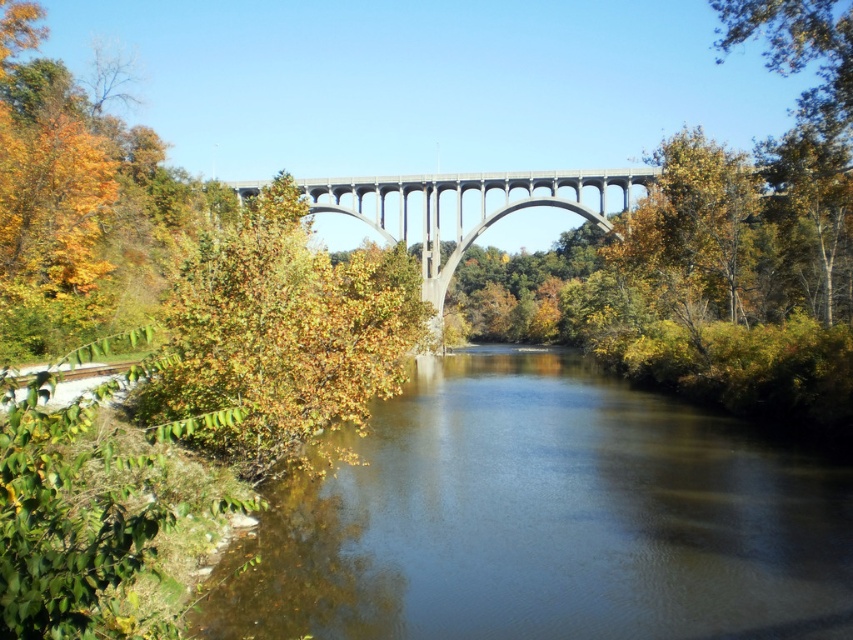
Question: Is the position of dark blue water at center less distant than that of green leafy tree at left?

Choices:
 (A) no
 (B) yes

Answer: (B)

Question: Which point is closer to the camera?

Choices:
 (A) dark blue water at center
 (B) concrete bridge at center
 (C) green leafy tree at left

Answer: (A)

Question: Can you confirm if green leafy tree at left is smaller than concrete bridge at center?

Choices:
 (A) no
 (B) yes

Answer: (A)

Question: Which object appears farthest from the camera in this image?

Choices:
 (A) dark blue water at center
 (B) green leafy tree at left

Answer: (B)

Question: Estimate the real-world distances between objects in this image. Which object is farther from the concrete bridge at center?

Choices:
 (A) green leafy tree at left
 (B) dark blue water at center

Answer: (B)

Question: Does dark blue water at center have a lesser width compared to green leafy tree at left?

Choices:
 (A) yes
 (B) no

Answer: (B)